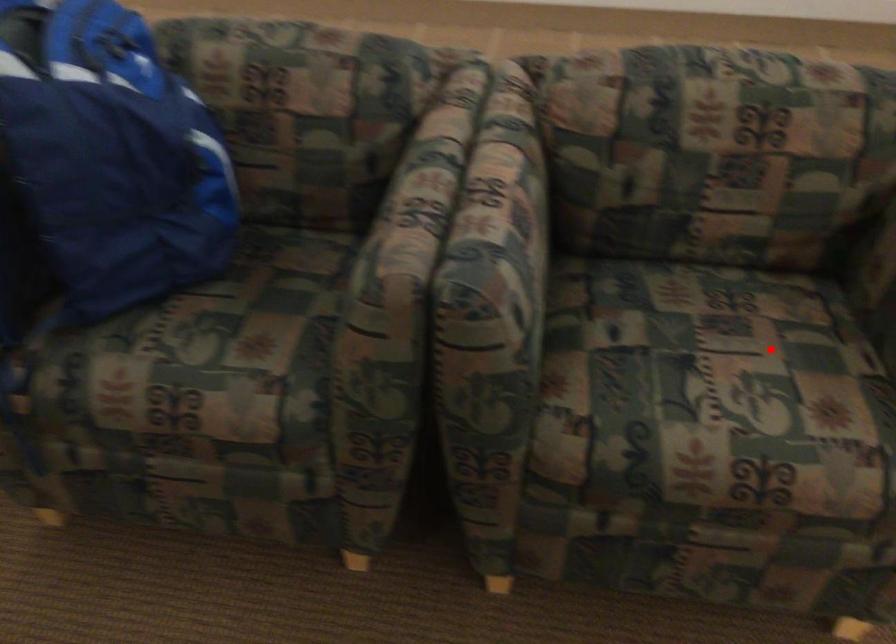
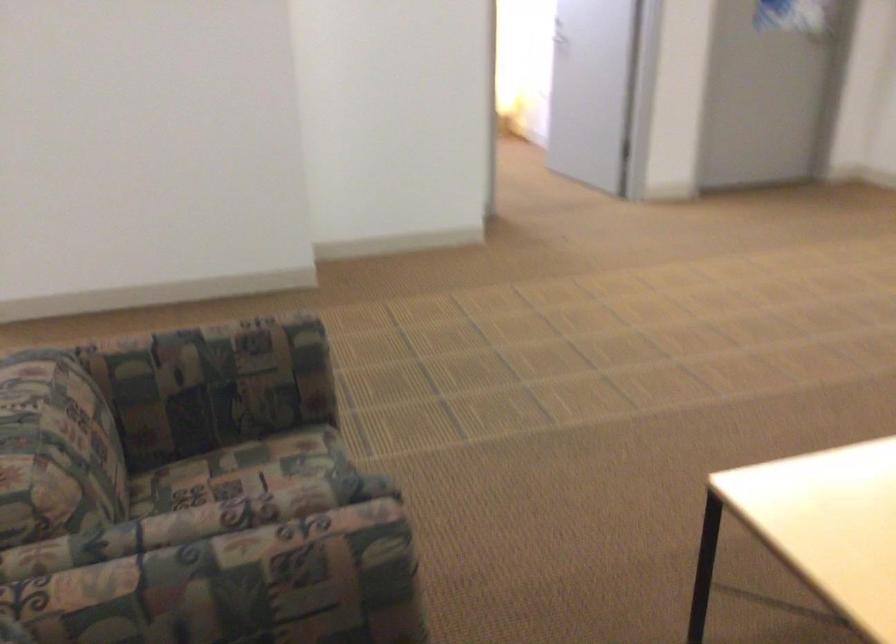
Question: I am providing you with two images of the same scene from different viewpoints. A red point is shown in image1. For the corresponding object point in image2, is it positioned nearer or farther from the camera?

Choices:
 (A) Nearer
 (B) Farther

Answer: (B)